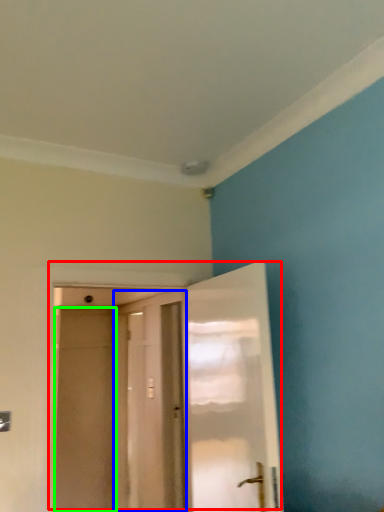
Question: Considering the real-world distances, which object is farthest from door (highlighted by a red box)? door (highlighted by a blue box) or screen door (highlighted by a green box)?

Choices:
 (A) door
 (B) screen door

Answer: (A)